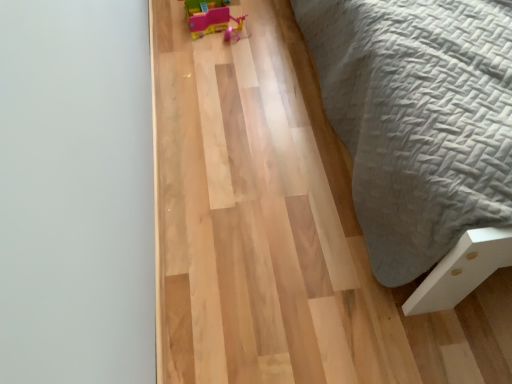
Locate an element on the screen. This screenshot has height=384, width=512. empty space that is ontop of natural wood floor at center is located at coordinates (273, 144).